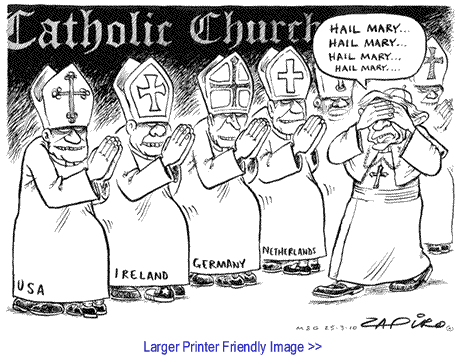
Where is `printer`? The width and height of the screenshot is (465, 355). printer is located at coordinates (197, 345).